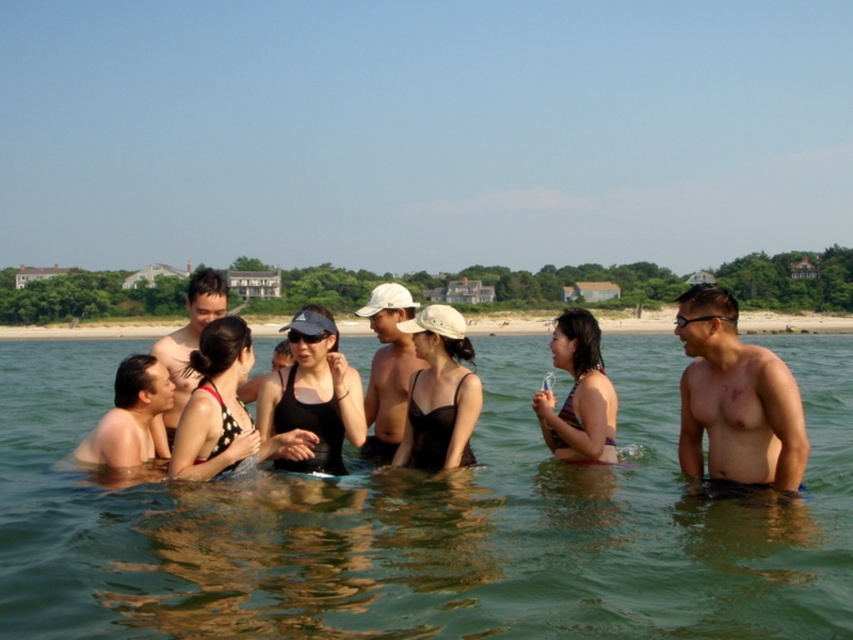
You are a photographer taking a group photo of the black matte swimsuit at center and the purple bikini at center. Which one is positioned to the left?

The black matte swimsuit at center is positioned to the left of the purple bikini at center.

You are at the beach and see the green water at center and the purple bikini at center. Which object is positioned to the left?

The purple bikini at center is positioned to the left of the green water at center.